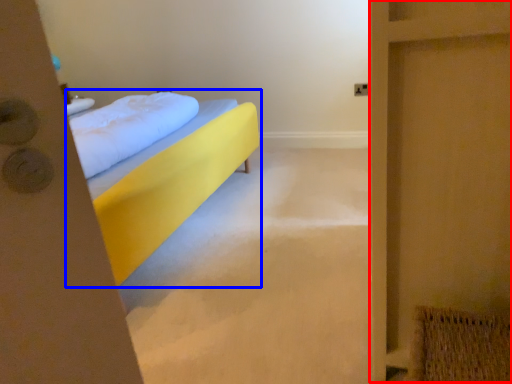
Question: Which of the following is the farthest to the observer, screen door (highlighted by a red box) or bed (highlighted by a blue box)?

Choices:
 (A) screen door
 (B) bed

Answer: (B)